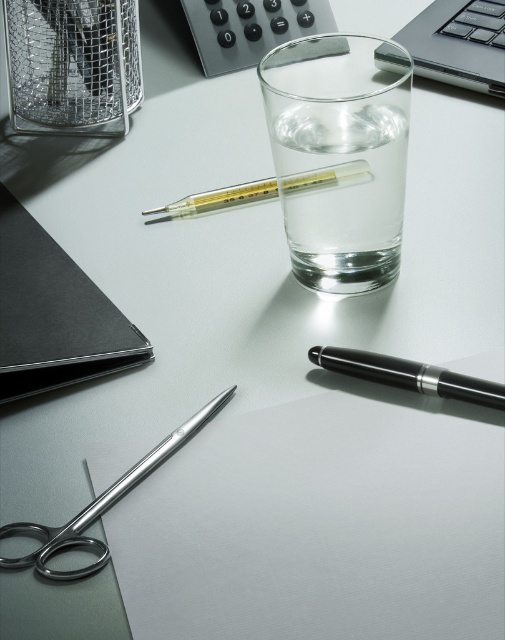
You are organizing items on your desk and need to place a new item between the silver metallic laptop at upper right and the black glossy pen at lower right. Based on their positions, which object is closer to you, and therefore where should you position the new item to maintain the spatial arrangement?

The silver metallic laptop at upper right is closer to you than the black glossy pen at lower right. To maintain the spatial arrangement, place the new item between them so it is closer to the silver metallic laptop at upper right.

You have a small container that can only hold items narrower than the black glossy pen at lower right. Can the polished metal scissors at lower left fit into the container?

→ The polished metal scissors at lower left have a width larger than the black glossy pen at lower right, so they cannot fit into the container designed for items narrower than the pen.

You are a delivery robot with a 12 inch wide package. You need to place it on the desk between the silver metallic laptop at upper right and the black glossy pen at lower right. Can you fit the package between them?

The distance between the silver metallic laptop at upper right and the black glossy pen at lower right is 10.18 inches. Since the package is 12 inches wide, it cannot fit in the space between them as the distance is smaller than the package width.